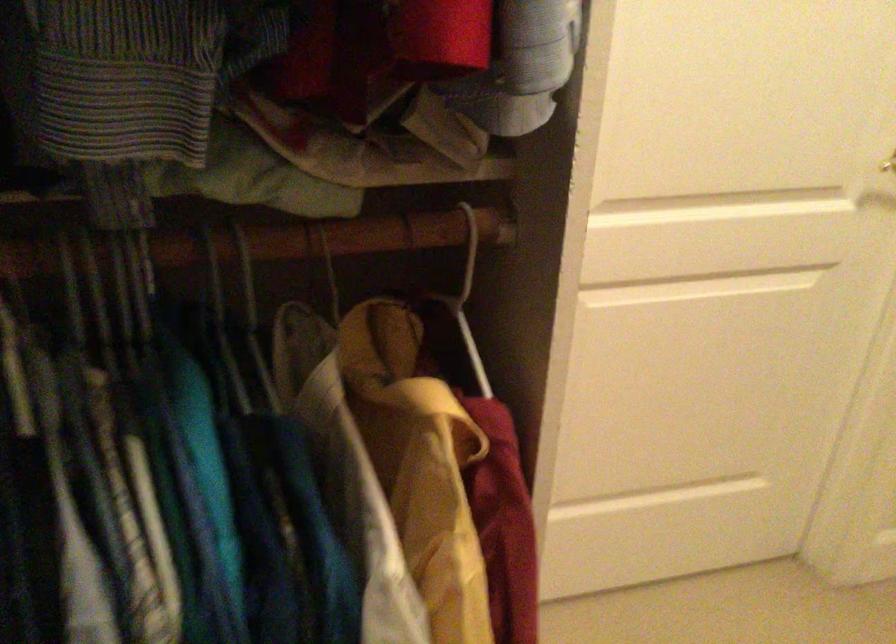
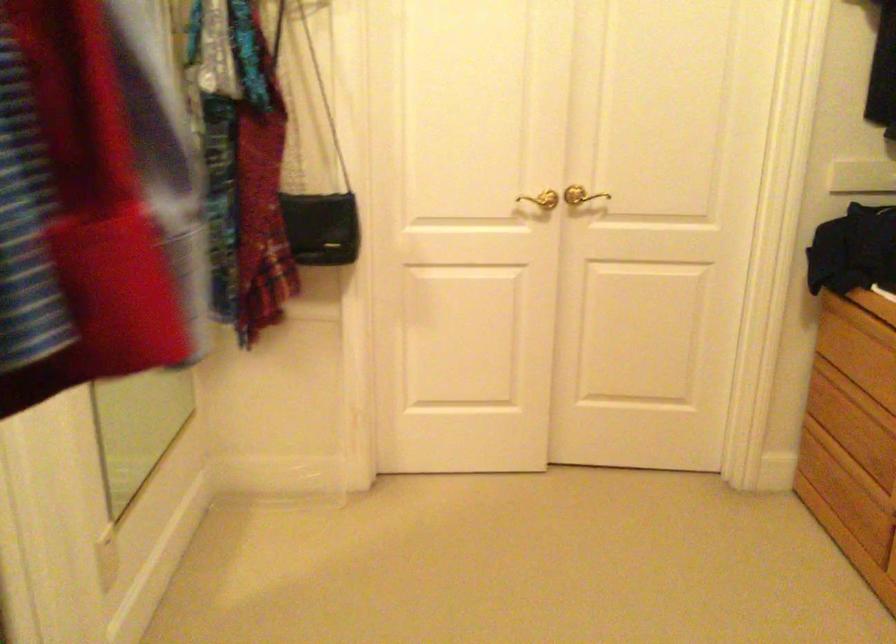
Question: The camera is either moving clockwise (left) or counter-clockwise (right) around the object. The first image is from the beginning of the video and the second image is from the end. Is the camera moving left or right when shooting the video?

Choices:
 (A) Left
 (B) Right

Answer: (A)